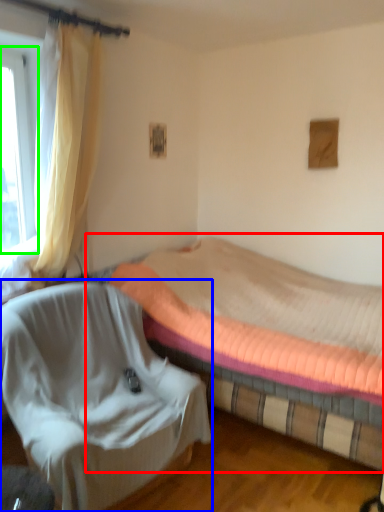
Question: Estimate the real-world distances between objects in this image. Which object is closer to bed (highlighted by a red box), chair (highlighted by a blue box) or window (highlighted by a green box)?

Choices:
 (A) chair
 (B) window

Answer: (A)